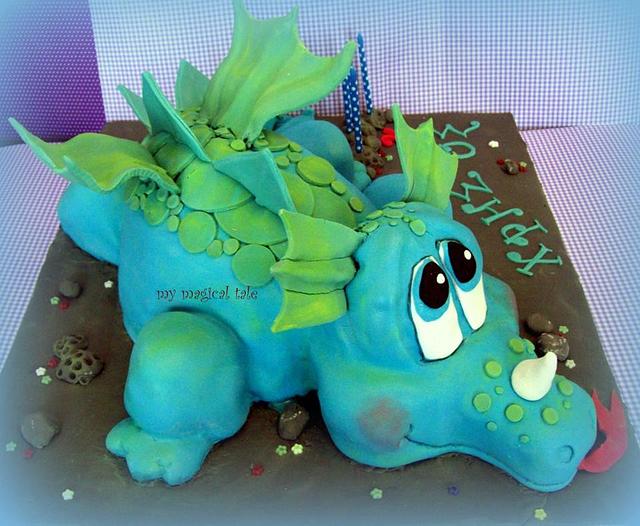
This screenshot has height=526, width=640. Identify the location of candle. (349, 107).